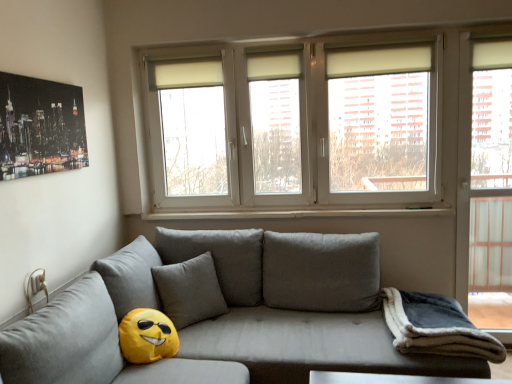
Image resolution: width=512 pixels, height=384 pixels. What are the coordinates of `dark gray fleece blanket at lower right` in the screenshot? It's located at (436, 327).

Image resolution: width=512 pixels, height=384 pixels. Describe the element at coordinates (40, 127) in the screenshot. I see `shiny metallic poster at upper left` at that location.

Identify the location of shiny metallic poster at upper left. This screenshot has height=384, width=512. click(40, 127).

What are the coordinates of `white matte curtain at upper center, which appears as the 2th curtain when viewed from the right` in the screenshot? It's located at (185, 73).

What do you see at coordinates (185, 73) in the screenshot? The image size is (512, 384). I see `white matte curtain at upper center, marked as the second curtain in a front-to-back arrangement` at bounding box center [185, 73].

The image size is (512, 384). What do you see at coordinates (339, 127) in the screenshot? I see `white plastic window at upper center` at bounding box center [339, 127].

Identify the location of matte gray couch at center. The image size is (512, 384). (227, 311).

Is white matte curtain at upper center, which appears as the 2th curtain when viewed from the right, positioned with its back to beige fabric curtain at upper center, arranged as the 2th curtain when viewed from the back?

That's not correct — white matte curtain at upper center, which appears as the 2th curtain when viewed from the right, is not looking away from beige fabric curtain at upper center, arranged as the 2th curtain when viewed from the back.

Who is smaller, white matte curtain at upper center, placed as the first curtain when sorted from left to right, or beige fabric curtain at upper center, arranged as the 2th curtain when viewed from the back?

Smaller between the two is white matte curtain at upper center, placed as the first curtain when sorted from left to right.

From the image's perspective, who appears lower, white matte curtain at upper center, placed as the first curtain when sorted from left to right, or beige fabric curtain at upper center, the 2th curtain viewed from the left?

white matte curtain at upper center, placed as the first curtain when sorted from left to right, from the image's perspective.

Which point is more forward, [154,67] or [1,142]?

Point [1,142]

Considering the positions of objects white matte curtain at upper center, which appears as the 2th curtain when viewed from the right, and shiny metallic poster at upper left in the image provided, who is in front, white matte curtain at upper center, which appears as the 2th curtain when viewed from the right, or shiny metallic poster at upper left?

shiny metallic poster at upper left.

Which object is positioned more to the right, white matte curtain at upper center, marked as the second curtain in a front-to-back arrangement, or shiny metallic poster at upper left?

From the viewer's perspective, white matte curtain at upper center, marked as the second curtain in a front-to-back arrangement, appears more on the right side.

This screenshot has height=384, width=512. In order to click on window sill that appears behind the transparent glass door at right in this screenshot , I will do `click(297, 213)`.

Between transparent glass door at right and white plastic window sill at center, which one has more height?

Result: Standing taller between the two is transparent glass door at right.

From a real-world perspective, is transparent glass door at right above or below white plastic window sill at center?

From a real-world perspective, transparent glass door at right is physically above white plastic window sill at center.

Considering the points (504, 236) and (423, 210), which point is behind, point (504, 236) or point (423, 210)?

The point (504, 236) is farther.

Is point (183, 286) in front of point (450, 376)?

No, it is not.

Considering the sizes of objects yellow fabric emoji at lower left and matte gray couch at center in the image provided, who is bigger, yellow fabric emoji at lower left or matte gray couch at center?

matte gray couch at center is bigger.

Looking at this image, measure the distance between yellow fabric emoji at lower left and matte gray couch at center.

yellow fabric emoji at lower left and matte gray couch at center are 10.49 inches apart.

Which is more to the left, white plastic window at upper center or shiny metallic poster at upper left?

From the viewer's perspective, shiny metallic poster at upper left appears more on the left side.

Considering the relative sizes of white plastic window at upper center and shiny metallic poster at upper left in the image provided, is white plastic window at upper center smaller than shiny metallic poster at upper left?

Actually, white plastic window at upper center might be larger than shiny metallic poster at upper left.

Could you tell me if white plastic window at upper center is turned towards shiny metallic poster at upper left?

Yes, white plastic window at upper center is oriented towards shiny metallic poster at upper left.

Does white plastic window at upper center have a lesser height compared to shiny metallic poster at upper left?

No, white plastic window at upper center is not shorter than shiny metallic poster at upper left.

This screenshot has height=384, width=512. Identify the location of picture frame in front of the dark gray fleece blanket at lower right. (40, 127).

From the image's perspective, does dark gray fleece blanket at lower right appear lower than shiny metallic poster at upper left?

Indeed, from the image's perspective, dark gray fleece blanket at lower right is shown beneath shiny metallic poster at upper left.

Is point (407, 313) positioned in front of point (6, 91)?

No, it is behind (6, 91).

From the image's perspective, would you say yellow fabric emoji at lower left is positioned over white matte curtain at upper center, acting as the 1th curtain starting from the back?

No.

Is yellow fabric emoji at lower left next to white matte curtain at upper center, marked as the second curtain in a front-to-back arrangement?

No, yellow fabric emoji at lower left is not next to white matte curtain at upper center, marked as the second curtain in a front-to-back arrangement.

Is yellow fabric emoji at lower left wider or thinner than white matte curtain at upper center, placed as the first curtain when sorted from left to right?

In the image, yellow fabric emoji at lower left appears to be wider than white matte curtain at upper center, placed as the first curtain when sorted from left to right.

Would you say white matte curtain at upper center, acting as the 1th curtain starting from the back, is part of yellow fabric emoji at lower left's contents?

No, white matte curtain at upper center, acting as the 1th curtain starting from the back, is located outside of yellow fabric emoji at lower left.

Where is `curtain lying below the beige fabric curtain at upper center, arranged as the first curtain when viewed from the front (from the image's perspective)`? The width and height of the screenshot is (512, 384). curtain lying below the beige fabric curtain at upper center, arranged as the first curtain when viewed from the front (from the image's perspective) is located at coordinates (185, 73).

Where is `picture frame that is under the white matte curtain at upper center, placed as the first curtain when sorted from left to right (from a real-world perspective)`? The height and width of the screenshot is (384, 512). picture frame that is under the white matte curtain at upper center, placed as the first curtain when sorted from left to right (from a real-world perspective) is located at coordinates (40, 127).

Considering their positions, is white matte curtain at upper center, marked as the second curtain in a front-to-back arrangement, positioned further to white plastic window at upper center than yellow fabric emoji at lower left?

Based on the image, yellow fabric emoji at lower left appears to be further to white plastic window at upper center.

Based on their spatial positions, is white plastic window at upper center or dark gray fleece blanket at lower right further from shiny metallic poster at upper left?

dark gray fleece blanket at lower right is positioned further to the anchor shiny metallic poster at upper left.

Considering their positions, is beige fabric curtain at upper center, arranged as the first curtain when viewed from the front, positioned closer to transparent glass door at right than yellow fabric emoji at lower left?

beige fabric curtain at upper center, arranged as the first curtain when viewed from the front.

Considering their positions, is shiny metallic poster at upper left positioned further to white matte curtain at upper center, marked as the second curtain in a front-to-back arrangement, than white plastic window at upper center?

shiny metallic poster at upper left lies further to white matte curtain at upper center, marked as the second curtain in a front-to-back arrangement, than the other object.

Based on their spatial positions, is dark gray fleece blanket at lower right or white plastic window at upper center further from transparent glass door at right?

dark gray fleece blanket at lower right lies further to transparent glass door at right than the other object.

Which object lies further to the anchor point dark gray fleece blanket at lower right, white plastic window sill at center or yellow fabric emoji at lower left?

The object further to dark gray fleece blanket at lower right is yellow fabric emoji at lower left.

Which object lies further to the anchor point white matte curtain at upper center, which appears as the 2th curtain when viewed from the right, white plastic window at upper center or yellow fabric emoji at lower left?

yellow fabric emoji at lower left.

When comparing their distances from shiny metallic poster at upper left, does transparent glass door at right or white plastic window sill at center seem further?

Based on the image, transparent glass door at right appears to be further to shiny metallic poster at upper left.

Where is `window situated between yellow fabric emoji at lower left and transparent glass door at right from left to right`? window situated between yellow fabric emoji at lower left and transparent glass door at right from left to right is located at coordinates (339, 127).

Find the location of a particular element. The width and height of the screenshot is (512, 384). window sill between yellow fabric emoji at lower left and transparent glass door at right in the horizontal direction is located at coordinates (297, 213).

This screenshot has height=384, width=512. I want to click on window between shiny metallic poster at upper left and dark gray fleece blanket at lower right, so click(339, 127).

Where is `window situated between white matte curtain at upper center, acting as the 1th curtain starting from the back, and transparent glass door at right from left to right`? Image resolution: width=512 pixels, height=384 pixels. window situated between white matte curtain at upper center, acting as the 1th curtain starting from the back, and transparent glass door at right from left to right is located at coordinates (339, 127).